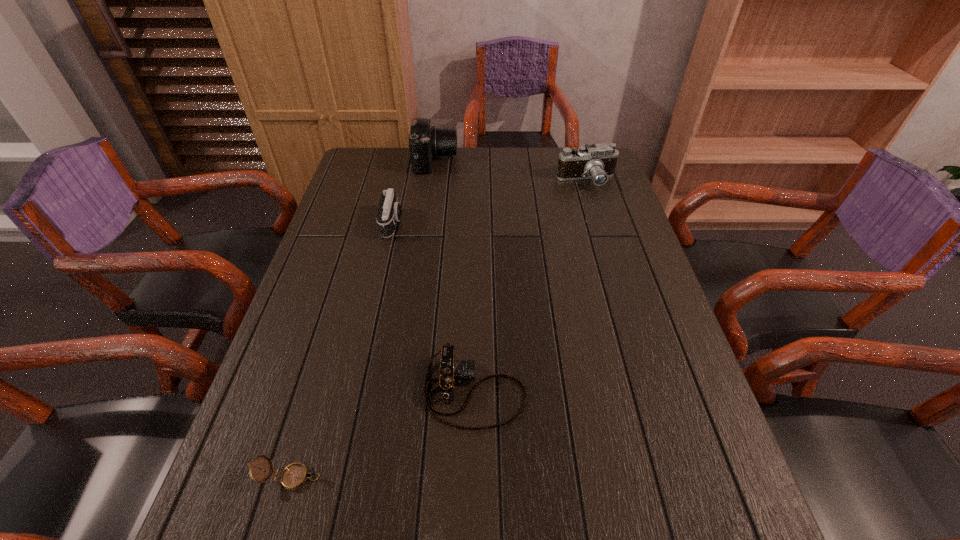
The height and width of the screenshot is (540, 960). I want to click on vacant space in between the nearest object and the rightmost camera, so click(x=439, y=329).

The image size is (960, 540). In order to click on vacant area that lies between the shortest camera and the third farthest object in this screenshot , I will do `click(434, 307)`.

The width and height of the screenshot is (960, 540). What are the coordinates of `vacant area between the second nearest camera and the compass` in the screenshot? It's located at (342, 350).

This screenshot has width=960, height=540. Find the location of `vacant space in between the shortest camera and the nearest object`. vacant space in between the shortest camera and the nearest object is located at coordinates (383, 434).

Identify the location of free spot between the third farthest camera and the shortest camera. The image size is (960, 540). (434, 307).

This screenshot has width=960, height=540. I want to click on vacant space in between the compass and the rightmost camera, so click(x=439, y=329).

You are a GUI agent. You are given a task and a screenshot of the screen. Output one action in this format:
    pyautogui.click(x=<x>, y=<y>)
    Task: Click on the free spot between the nearest object and the rightmost camera
    The image size is (960, 540).
    Given the screenshot: What is the action you would take?
    pyautogui.click(x=439, y=329)

The image size is (960, 540). In order to click on empty location between the tallest camera and the rightmost object in this screenshot , I will do `click(511, 171)`.

You are a GUI agent. You are given a task and a screenshot of the screen. Output one action in this format:
    pyautogui.click(x=<x>, y=<y>)
    Task: Click on the vacant space that is in between the rightmost object and the compass
    This screenshot has width=960, height=540.
    Given the screenshot: What is the action you would take?
    pyautogui.click(x=439, y=329)

Find the location of a particular element. The height and width of the screenshot is (540, 960). object that is the third closest to the rightmost camera is located at coordinates (451, 370).